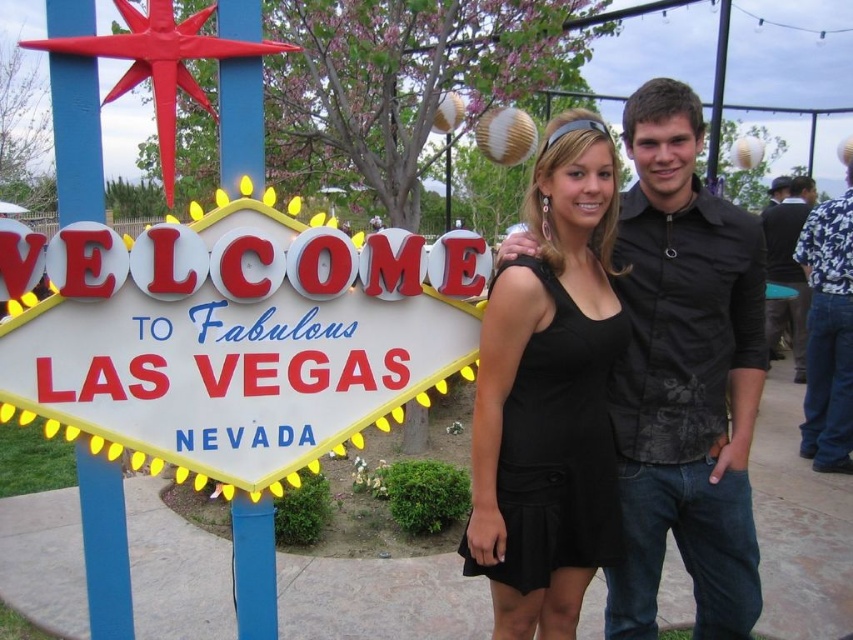
Which is below, black matte shirt at center or black textured shirt at right?

black matte shirt at center

Looking at this image, is black matte shirt at center bigger than black textured shirt at right?

Actually, black matte shirt at center might be smaller than black textured shirt at right.

Locate an element on the screen. black matte shirt at center is located at coordinates (685, 376).

Is metallic red sign at left shorter than black satin dress at center?

Indeed, metallic red sign at left has a lesser height compared to black satin dress at center.

What are the coordinates of `metallic red sign at left` in the screenshot? It's located at click(x=238, y=339).

Where is `metallic red sign at left`? metallic red sign at left is located at coordinates (238, 339).

Locate an element on the screen. Image resolution: width=853 pixels, height=640 pixels. metallic red sign at left is located at coordinates (238, 339).

Who is higher up, black matte shirt at center or black satin dress at center?

black satin dress at center is higher up.

This screenshot has width=853, height=640. What do you see at coordinates (685, 376) in the screenshot?
I see `black matte shirt at center` at bounding box center [685, 376].

Is point (659, 337) closer to camera compared to point (604, 161)?

No, it is not.

Image resolution: width=853 pixels, height=640 pixels. What are the coordinates of `black matte shirt at center` in the screenshot? It's located at (685, 376).